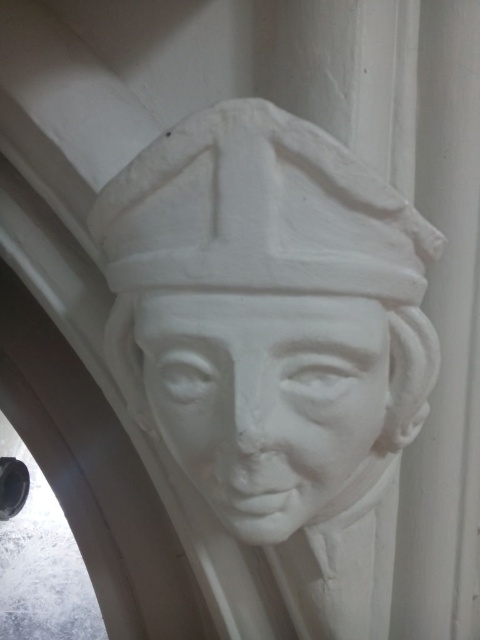
You are an art conservator assessing two sculptures in a gallery. You notice the white marble bust at center and the white matte sculpture at center. Which one has a greater height?

The white marble bust at center is taller than the white matte sculpture at center.

You are standing 30 inches away from the sculpture and want to get a closer look at the point at coordinates point (x=149, y=320). How much closer can you move to the sculpture without exceeding the safe viewing distance of 24 inches?

The point at coordinates point (x=149, y=320) is currently 26.11 inches away from the camera. To stay within the safe viewing distance of 24 inches, you can move 2.11 inches closer.

You are an art conservator working on a restoration project. You need to place a protective cover over both the white marble bust at center and the white matte sculpture at center. What is the minimum width of the cover required to cover both objects?

The white marble bust at center and the white matte sculpture at center are 1.00 inches apart, so the minimum width of the cover should be at least 1.00 inches to cover both objects.